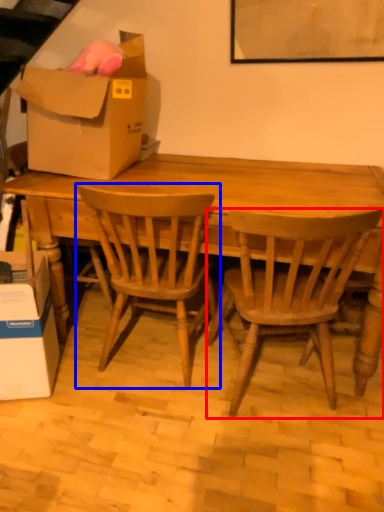
Question: Which object appears farthest to the camera in this image, chair (highlighted by a red box) or chair (highlighted by a blue box)?

Choices:
 (A) chair
 (B) chair

Answer: (B)